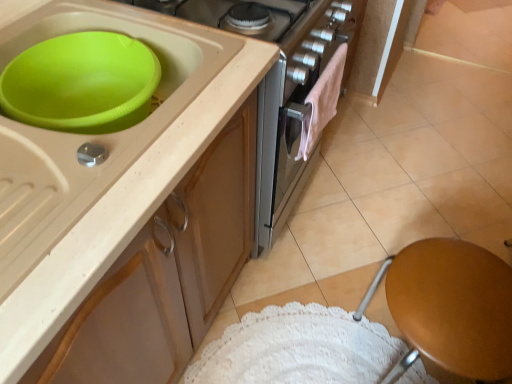
Question: Considering the positions of beige matte tile at upper right and pink fluffy towel at center in the image, is beige matte tile at upper right taller or shorter than pink fluffy towel at center?

Choices:
 (A) tall
 (B) short

Answer: (B)

Question: Is point (510, 16) positioned closer to the camera than point (306, 158)?

Choices:
 (A) farther
 (B) closer

Answer: (A)

Question: Which of these objects is positioned closest to the pink fluffy towel at center?

Choices:
 (A) brown wooden stool at lower right
 (B) beige matte tile at upper right
 (C) matte beige cabinet at upper left

Answer: (C)

Question: Which of these objects is positioned farthest from the brown wooden stool at lower right?

Choices:
 (A) matte beige cabinet at upper left
 (B) pink fluffy towel at center
 (C) beige matte tile at upper right

Answer: (C)